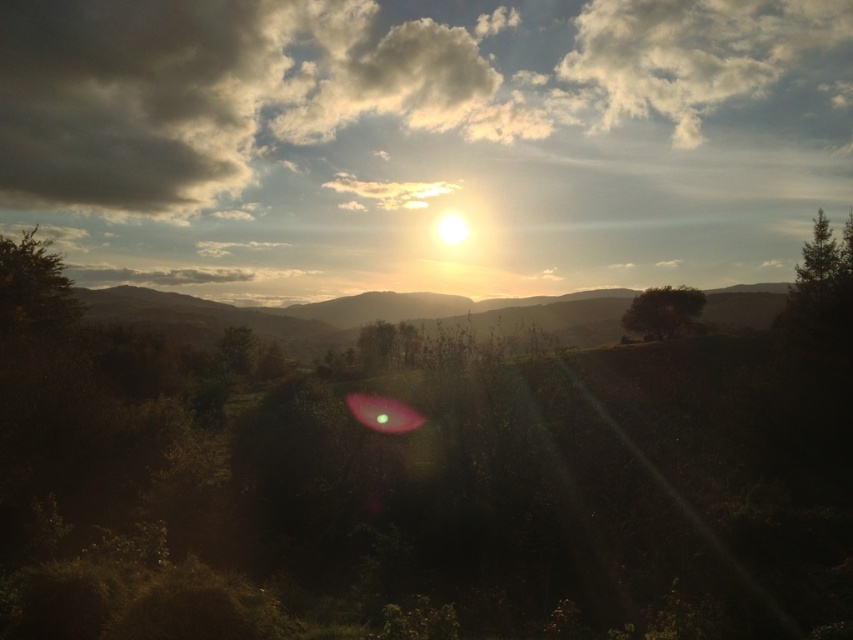
You are standing in the serene landscape scene. There is a point marked at coordinates (422, 140). What object is located at that point?

The point at coordinates (422, 140) marks the cloudy sky at center.

Looking at this image, you are an environmental scientist studying tree growth in this area. You observe the green leafy tree at left and the green matte tree at upper right. Which tree would you expect to have a shorter shadow at this time of day, and why?

The green leafy tree at left has a lesser height compared to the green matte tree at upper right. Since the sun is near the horizon, taller trees cast longer shadows. Therefore, the green leafy tree at left would have a shorter shadow because it is shorter in height than the green matte tree at upper right.

You are standing in the middle of the forest and see the green leafy tree at left and the green leafy tree at center. Which tree is closer to you?

The green leafy tree at center is closer to you because the green leafy tree at left is positioned over it, indicating it is farther away.